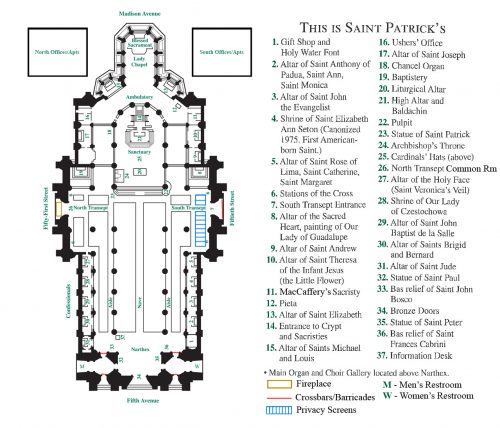
At what (x,y) coordinates should I click in order to perform the action: click on entrances. Please return your answer as a coordinate pair (x, y). The width and height of the screenshot is (500, 428). Looking at the image, I should click on (137, 374).